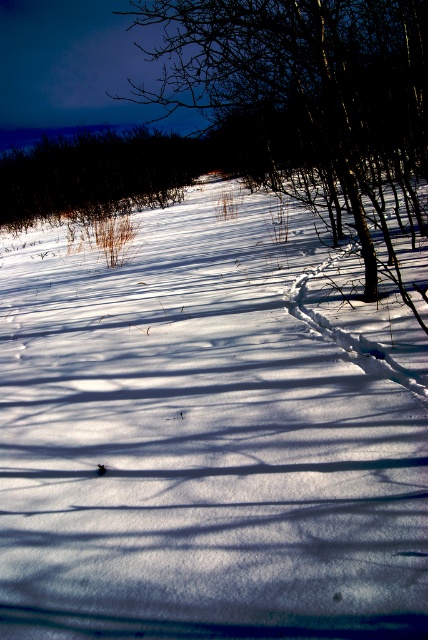
Question: Among these objects, which one is nearest to the camera?

Choices:
 (A) white snow at center
 (B) dark brown shrub at upper left
 (C) brown textured tree at center

Answer: (A)

Question: Which object is positioned farthest from the dark brown shrub at upper left?

Choices:
 (A) brown textured tree at center
 (B) white snow at center

Answer: (B)

Question: Which of the following is the farthest from the observer?

Choices:
 (A) dark brown shrub at upper left
 (B) brown textured tree at center

Answer: (A)

Question: Is brown textured tree at center positioned behind dark brown shrub at upper left?

Choices:
 (A) yes
 (B) no

Answer: (B)

Question: Does brown textured tree at center appear on the left side of dark brown shrub at upper left?

Choices:
 (A) yes
 (B) no

Answer: (B)

Question: Can you confirm if white snow at center is bigger than dark brown shrub at upper left?

Choices:
 (A) yes
 (B) no

Answer: (A)